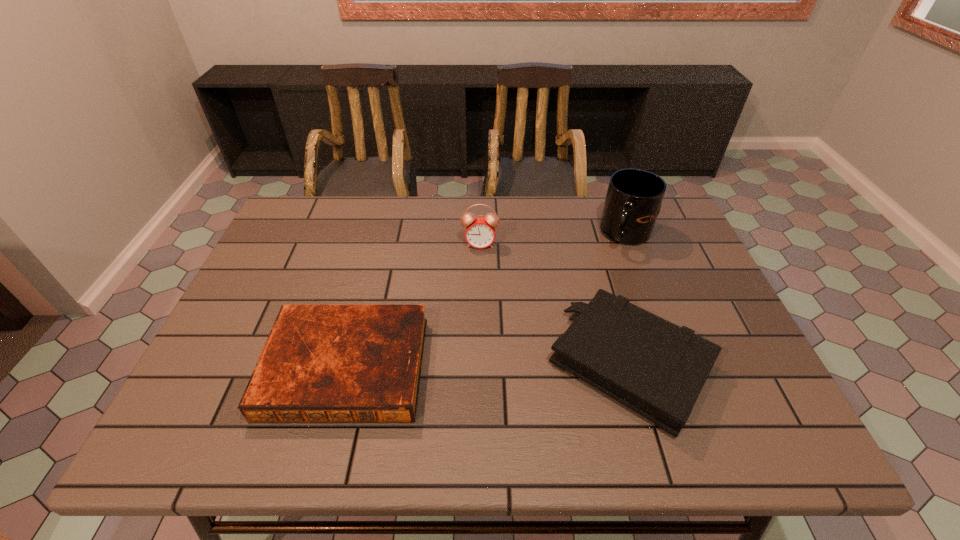
The image size is (960, 540). Find the location of `free space on the desktop that is between the shortest object and the right Bible and is positioned with the handle on the side of the tallest object`. free space on the desktop that is between the shortest object and the right Bible and is positioned with the handle on the side of the tallest object is located at coordinates pyautogui.click(x=485, y=365).

Locate an element on the screen. free space on the desktop that is between the left Bible and the taller Bible and is positioned on the clock face of the alarm clock is located at coordinates (471, 365).